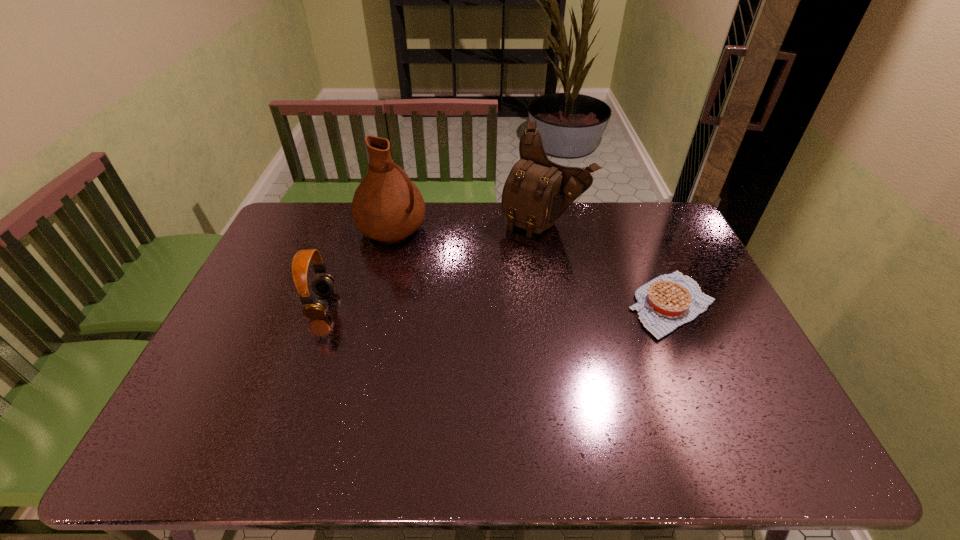
At what (x,y) coordinates should I click in order to perform the action: click on vacant space located 0.070m on the side of the pitcher with the handle. Please return your answer as a coordinate pair (x, y). Looking at the image, I should click on (429, 253).

Where is `vacant region located on the side of the pitcher with the handle`? This screenshot has height=540, width=960. vacant region located on the side of the pitcher with the handle is located at coordinates (496, 295).

Find the location of a particular element. Image resolution: width=960 pixels, height=540 pixels. vacant area located on the side of the pitcher with the handle is located at coordinates (492, 293).

You are a GUI agent. You are given a task and a screenshot of the screen. Output one action in this format:
    pyautogui.click(x=<x>, y=<y>)
    Task: Click on the shoulder bag located in the far edge section of the desktop
    This screenshot has width=960, height=540.
    Given the screenshot: What is the action you would take?
    pyautogui.click(x=537, y=191)

The image size is (960, 540). I want to click on pitcher located at the far edge, so click(387, 206).

Locate an element on the screen. object situated at the right edge is located at coordinates (668, 301).

Locate an element on the screen. The image size is (960, 540). free space at the far edge is located at coordinates (564, 221).

Identify the location of blank space at the near edge of the desktop. Image resolution: width=960 pixels, height=540 pixels. [x=653, y=403].

This screenshot has width=960, height=540. I want to click on vacant space at the right edge, so click(680, 328).

Where is `vacant point at the far left corner`? The width and height of the screenshot is (960, 540). vacant point at the far left corner is located at coordinates (287, 239).